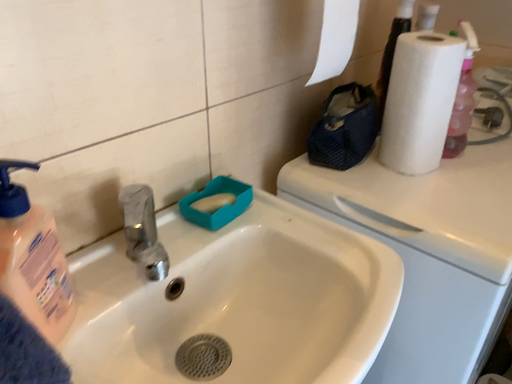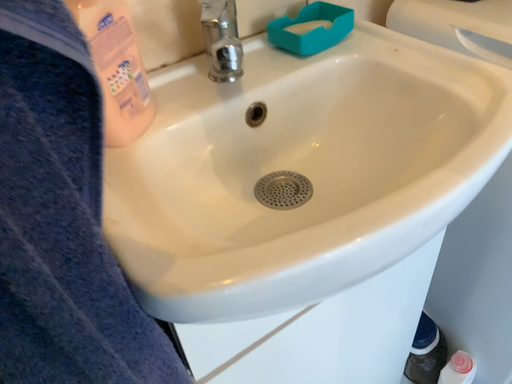
Question: How did the camera likely rotate when shooting the video?

Choices:
 (A) rotated downward
 (B) rotated upward

Answer: (A)